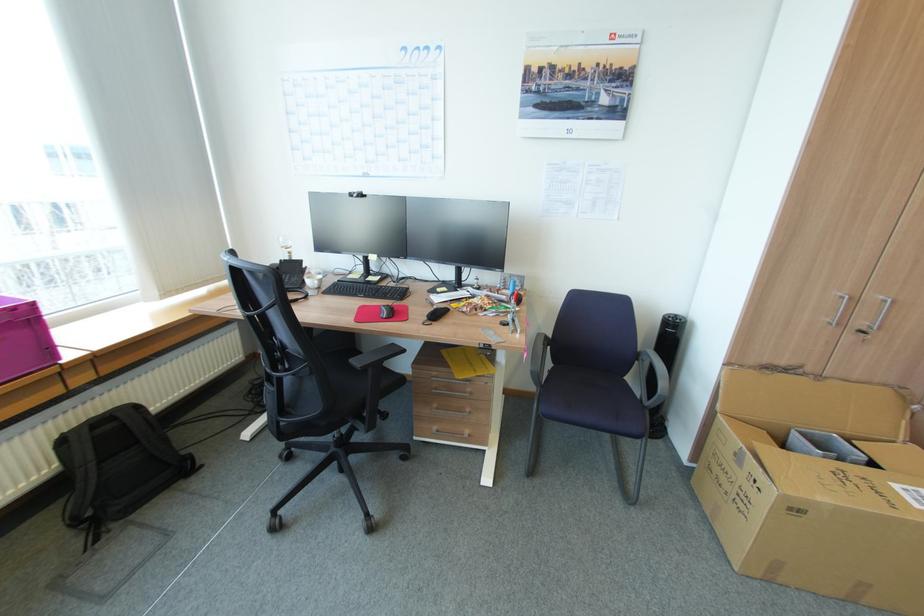
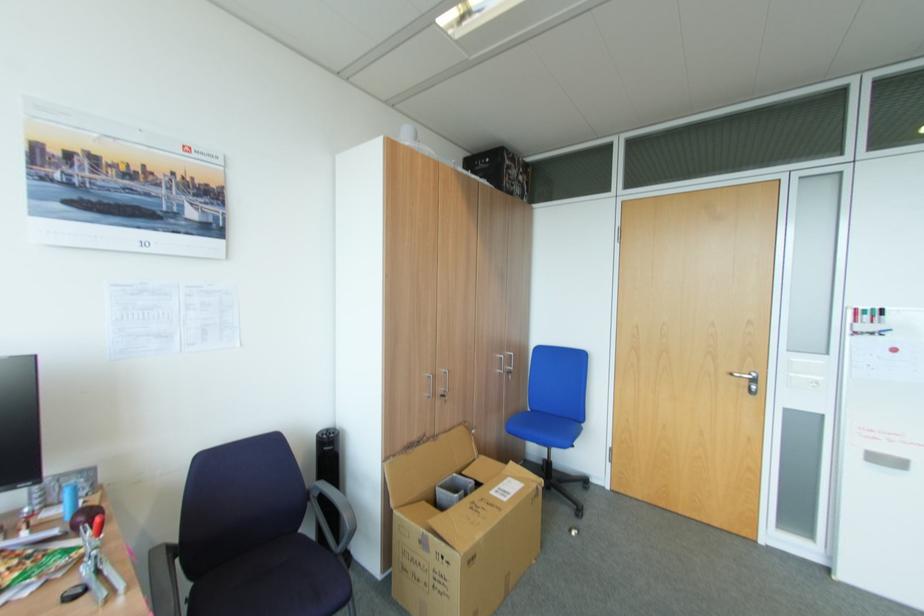
Locate, in the second image, the point that corresponds to (x=557, y=368) in the first image.

(198, 588)